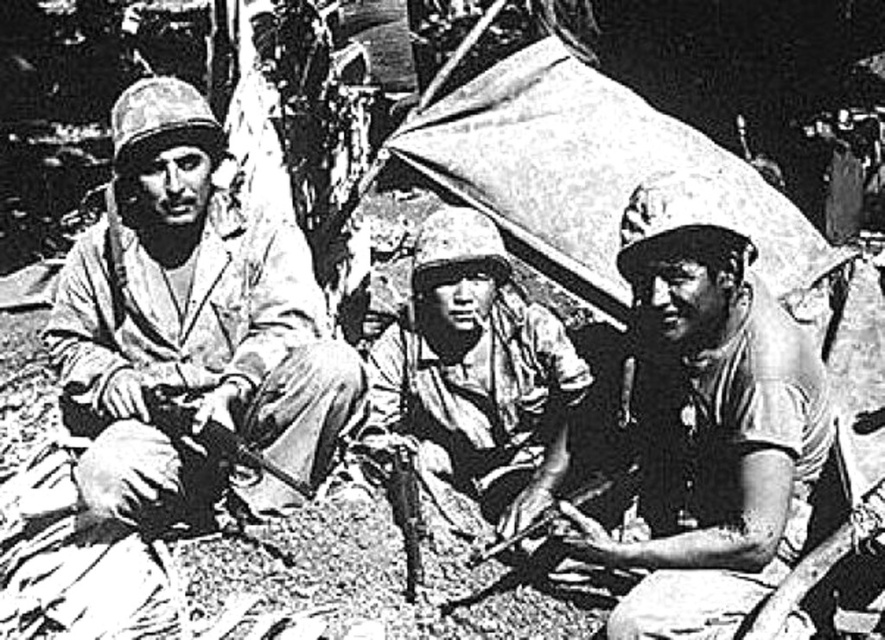
Question: Is matte khaki helmet at center to the right of camouflage fabric helmet at center from the viewer's perspective?

Choices:
 (A) yes
 (B) no

Answer: (A)

Question: Which point appears closest to the camera in this image?

Choices:
 (A) (743, 525)
 (B) (474, 316)
 (C) (242, 490)

Answer: (A)

Question: Which object appears closest to the camera in this image?

Choices:
 (A) camouflage fabric helmet at center
 (B) matte khaki helmet at center

Answer: (B)

Question: Is matte khaki uniform at left smaller than matte khaki helmet at center?

Choices:
 (A) no
 (B) yes

Answer: (A)

Question: Which point is farther from the camera taking this photo?

Choices:
 (A) [x=444, y=248]
 (B) [x=807, y=488]
 (C) [x=304, y=464]

Answer: (A)

Question: Does matte khaki helmet at center have a larger size compared to camouflage fabric helmet at center?

Choices:
 (A) no
 (B) yes

Answer: (A)